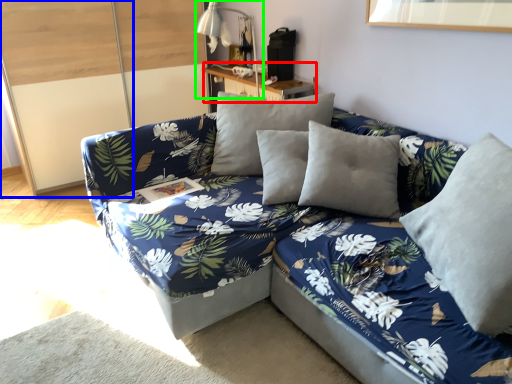
Question: Which is nearer to the table (highlighted by a red box)? glass door (highlighted by a blue box) or table lamp (highlighted by a green box).

Choices:
 (A) glass door
 (B) table lamp

Answer: (B)